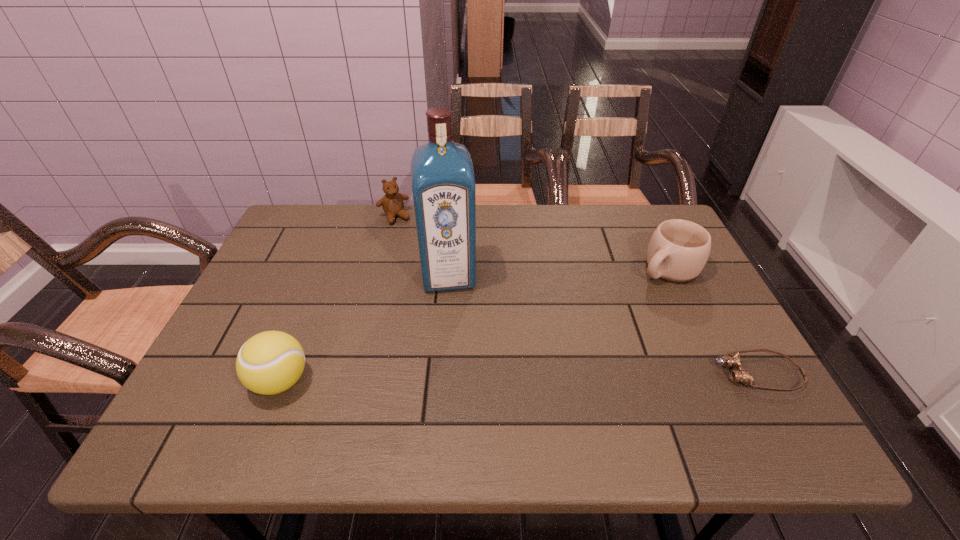
You are a GUI agent. You are given a task and a screenshot of the screen. Output one action in this format:
    pyautogui.click(x=<x>, y=<y>)
    Task: Click on the vacant space on the desktop that is between the tennis ball and the shortest object and is positioned on the side of the mug with the handle
    The width and height of the screenshot is (960, 540).
    Given the screenshot: What is the action you would take?
    pyautogui.click(x=508, y=377)

Locate an element on the screen. The width and height of the screenshot is (960, 540). vacant spot on the desktop that is between the tennis ball and the goggles and is positioned on the flat label side of the third object from right to left is located at coordinates (460, 378).

The width and height of the screenshot is (960, 540). What are the coordinates of `vacant space on the desktop that is between the leftmost object and the goggles and is positioned on the front-facing side of the second object from left to right` in the screenshot? It's located at (491, 377).